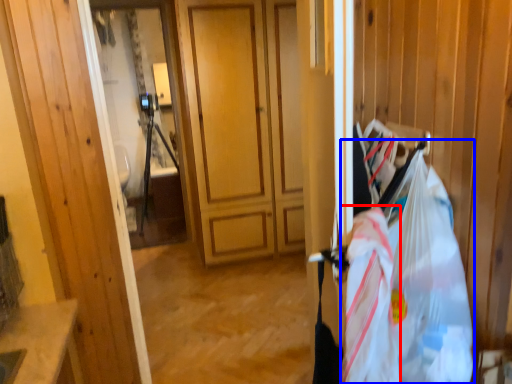
Question: Which point is further to the camera, grocery bag (highlighted by a red box) or grocery bag (highlighted by a blue box)?

Choices:
 (A) grocery bag
 (B) grocery bag

Answer: (A)